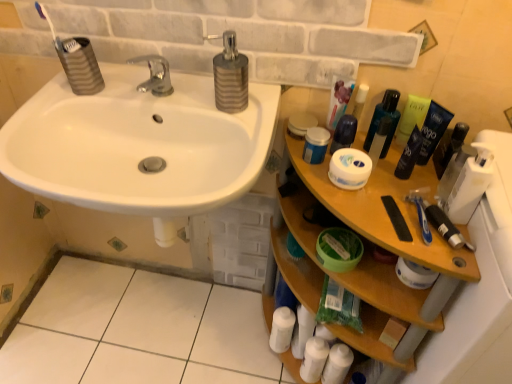
I want to click on free location to the right of silver metallic faucet at center, so click(x=211, y=113).